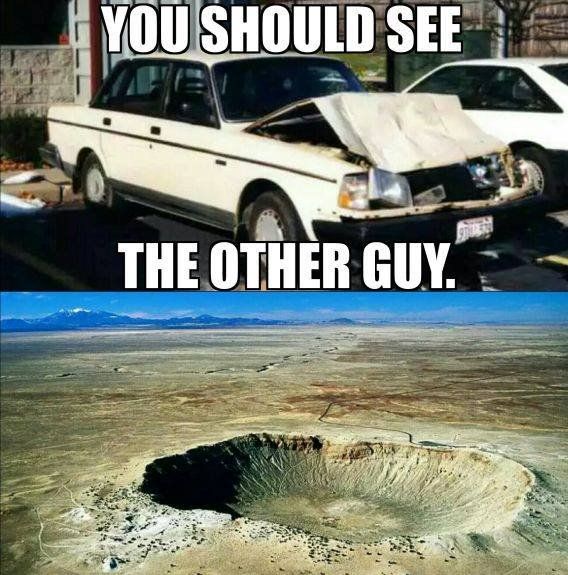
This screenshot has height=575, width=568. Find the location of `windows`. windows is located at coordinates (513, 92), (473, 75), (190, 97), (137, 82).